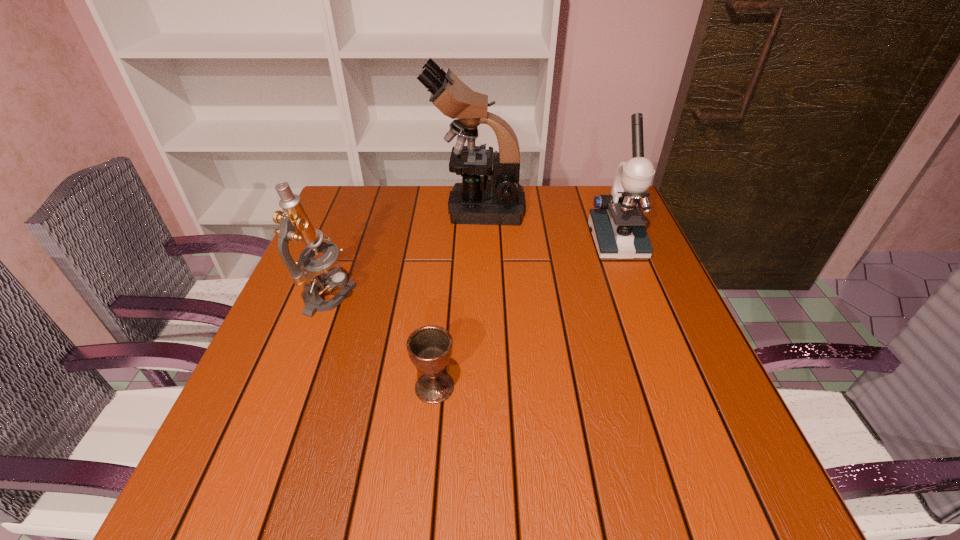
This screenshot has width=960, height=540. What are the coordinates of `unoccupied area between the shortest object and the second microscope from right to left` in the screenshot? It's located at (456, 298).

Where is `free space between the rightmost microscope and the second nearest object`? The height and width of the screenshot is (540, 960). free space between the rightmost microscope and the second nearest object is located at coordinates (473, 269).

Locate an element on the screen. The width and height of the screenshot is (960, 540). free space that is in between the tallest microscope and the nearest object is located at coordinates (456, 298).

The width and height of the screenshot is (960, 540). Identify the location of free space between the leftmost microscope and the shortest object. (382, 342).

Identify the location of blank region between the tallest object and the leftmost microscope. (403, 253).

This screenshot has height=540, width=960. What are the coordinates of `empty space between the second nearest object and the rightmost microscope` in the screenshot? It's located at (473, 269).

At what (x,y) coordinates should I click in order to perform the action: click on vacant area that lies between the leftmost microscope and the tallest object. Please return your answer as a coordinate pair (x, y). Image resolution: width=960 pixels, height=540 pixels. Looking at the image, I should click on (403, 253).

Find the location of a particular element. The image size is (960, 540). free space between the rightmost microscope and the leftmost object is located at coordinates (473, 269).

The width and height of the screenshot is (960, 540). Find the location of `vacant area between the nearest object and the rightmost microscope`. vacant area between the nearest object and the rightmost microscope is located at coordinates (525, 314).

Where is `free space between the rightmost object and the second microscope from right to left`? The image size is (960, 540). free space between the rightmost object and the second microscope from right to left is located at coordinates (546, 225).